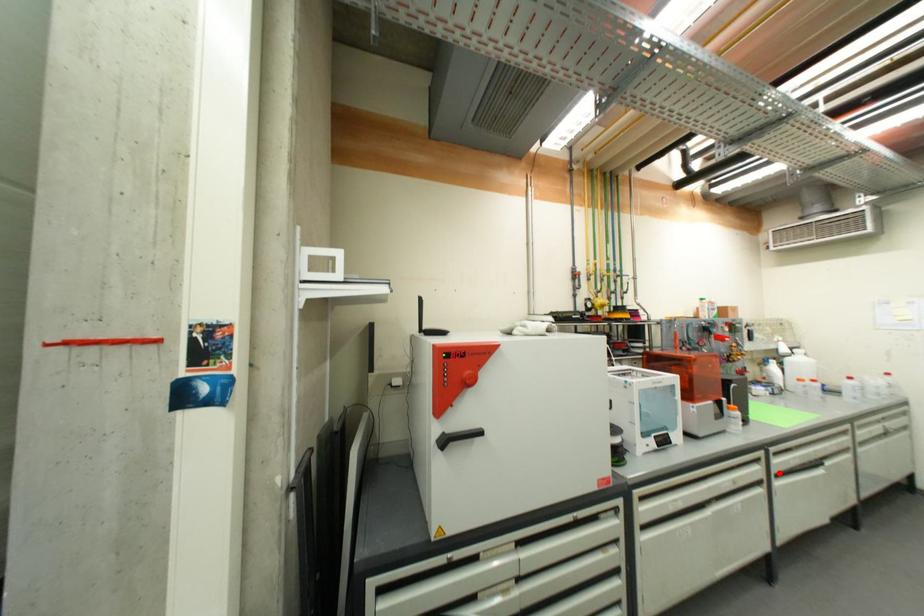
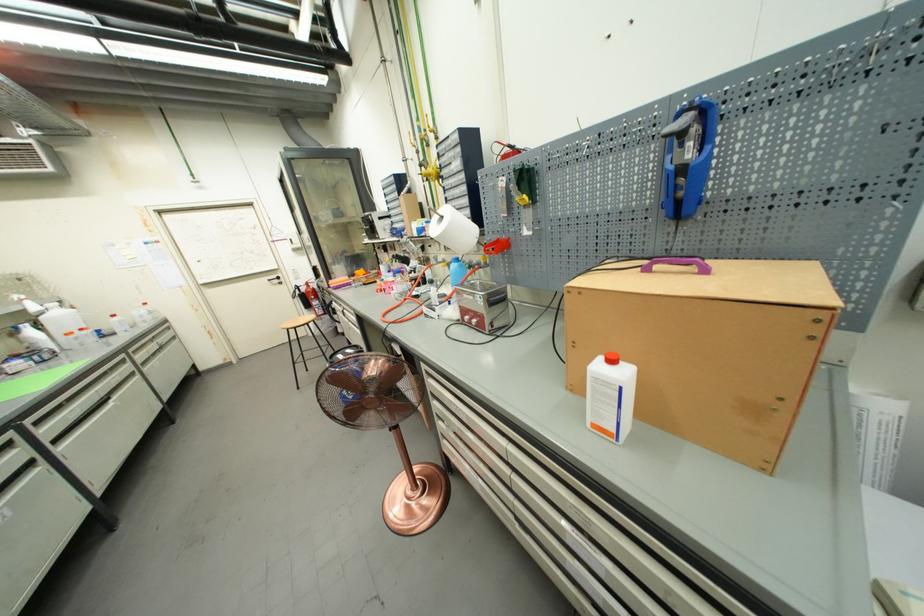
Question: A red point is marked in image1. In image2, is the corresponding 3D point closer to the camera or farther? Reply with the corresponding letter.

Choices:
 (A) The corresponding 3D point is closer.
 (B) The corresponding 3D point is farther.

Answer: (B)